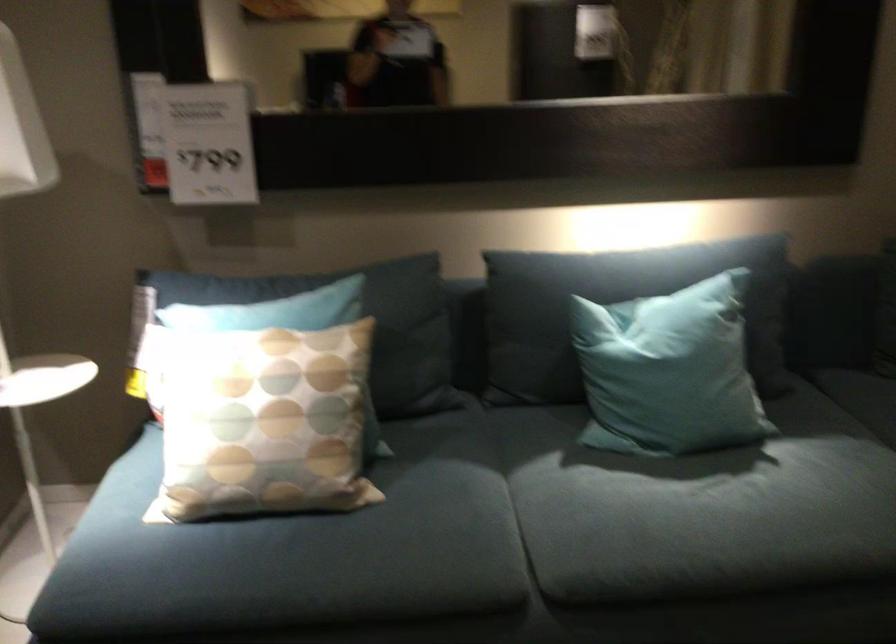
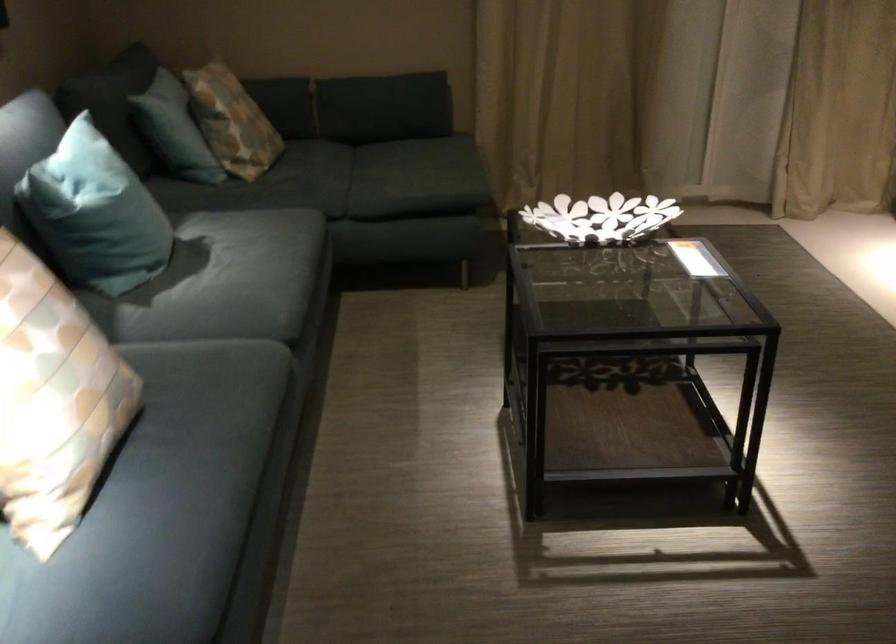
The point at (598, 351) is marked in the first image. Where is the corresponding point in the second image?

(95, 214)